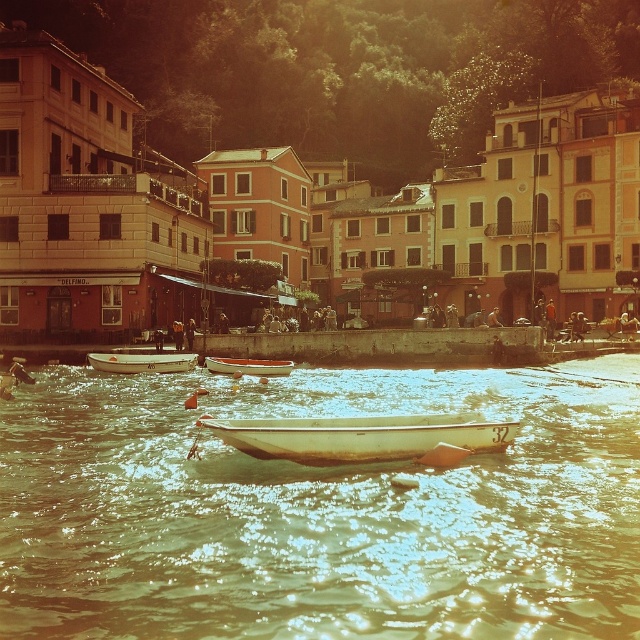
Who is positioned more to the right, white matte boat at center or wooden boat at center?

white matte boat at center is more to the right.

Is white matte boat at center to the left of wooden boat at center from the viewer's perspective?

Incorrect, white matte boat at center is not on the left side of wooden boat at center.

Is point (284, 432) closer to viewer compared to point (227, 369)?

Yes, point (284, 432) is in front of point (227, 369).

I want to click on white matte boat at center, so click(360, 436).

Does point (280, 424) come behind point (129, 355)?

No.

This screenshot has height=640, width=640. What do you see at coordinates (360, 436) in the screenshot?
I see `white matte boat at center` at bounding box center [360, 436].

At what (x,y) coordinates should I click in order to perform the action: click on white matte boat at center. Please return your answer as a coordinate pair (x, y). This screenshot has height=640, width=640. Looking at the image, I should click on (360, 436).

Where is `white matte boat at center`? white matte boat at center is located at coordinates click(x=360, y=436).

Who is taller, clear water at boat center or white matte boat at center?

Standing taller between the two is clear water at boat center.

Is point (54, 518) closer to camera compared to point (305, 440)?

Yes, it is in front of point (305, 440).

You are a GUI agent. You are given a task and a screenshot of the screen. Output one action in this format:
    pyautogui.click(x=<x>, y=<y>)
    Task: Click on the clear water at boat center
    This screenshot has width=640, height=640.
    Given the screenshot: What is the action you would take?
    pyautogui.click(x=320, y=509)